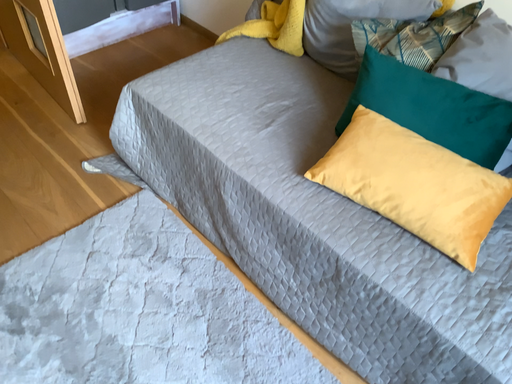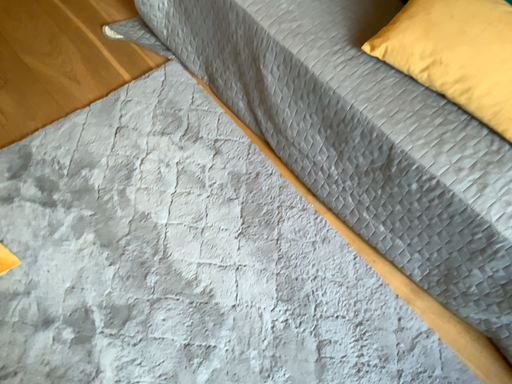
Question: How did the camera likely rotate when shooting the video?

Choices:
 (A) rotated upward
 (B) rotated downward

Answer: (B)